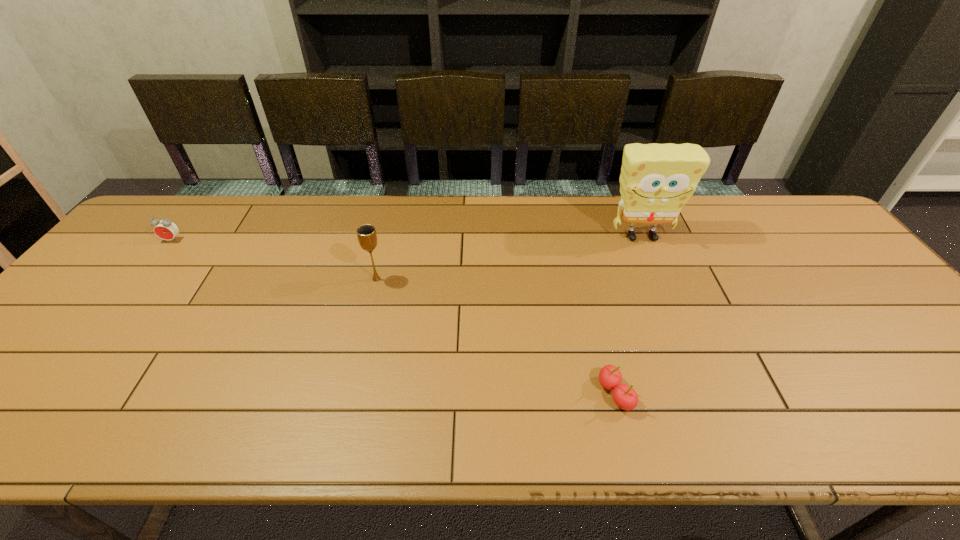
Identify the location of object that is the second closest to the alarm clock. This screenshot has height=540, width=960. (625, 397).

Choose which object is the second nearest neighbor to the third shortest object. Please provide its 2D coordinates. Your answer should be formatted as a tuple, i.e. [(x, y)], where the tuple contains the x and y coordinates of a point satisfying the conditions above.

[(165, 229)]

You are a GUI agent. You are given a task and a screenshot of the screen. Output one action in this format:
    pyautogui.click(x=<x>, y=<y>)
    Task: Click on the free space that satisfies the following two spatial constraints: 1. on the face of the leftmost object; 2. on the right side of the chalice
    The width and height of the screenshot is (960, 540).
    Given the screenshot: What is the action you would take?
    pos(142,279)

The width and height of the screenshot is (960, 540). Identify the location of free space that satisfies the following two spatial constraints: 1. on the face of the second nearest object; 2. on the right side of the alarm clock. (142, 279).

Where is `vacant area in the image that satisfies the following two spatial constraints: 1. on the front side of the second object from left to right; 2. on the left side of the nearest object`? vacant area in the image that satisfies the following two spatial constraints: 1. on the front side of the second object from left to right; 2. on the left side of the nearest object is located at coordinates (348, 394).

Locate an element on the screen. This screenshot has height=540, width=960. vacant space that satisfies the following two spatial constraints: 1. on the face of the nearest object; 2. on the right side of the alarm clock is located at coordinates (51, 394).